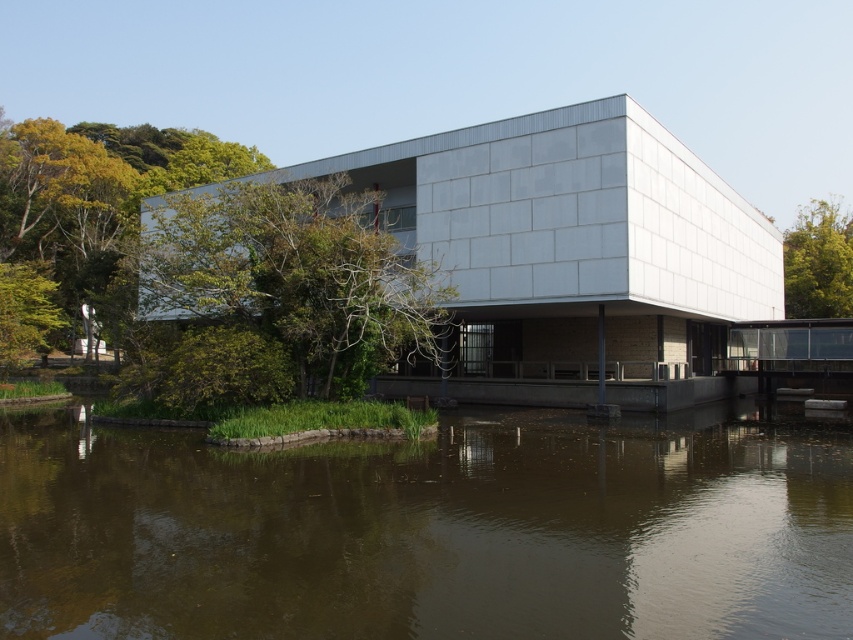
You are standing at the point labeled point (712, 483). You want to walk to the entrance of the building. The entrance is located at the point labeled point 0.244, 0.163. The distance between these two points is 11.78 meters. Can you walk directly to the entrance without any obstacles?

The distance between point (712, 483) and point 0.244, 0.163 is 11.78 meters. There are no obstacles mentioned in the scene description, so you can walk directly to the entrance.

You are standing at the base of one of the vertical columns supporting the building. You notice two points marked on the water surface ahead of you. The first point is labeled as point [193,492] and the second is point [169,310]. Which of these two points is closer to you?

Point [193,492] is in front of point [169,310], so it is closer to you.

You are an architect designing a new pathway that needs to pass between the brown murky water at lower center and the green leafy tree at upper right. Given the spatial constraints, which object requires more consideration for width adjustments to ensure the pathway is wide enough for two people to walk side by side?

The green leafy tree at upper right requires more consideration because its width is greater than the brown murky water at lower center, so adjusting its position or the pathway around it would be necessary to accommodate the required width for two people walking side by side.